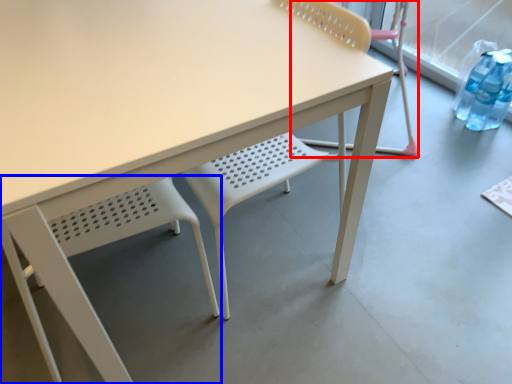
Question: Which object is further to the camera taking this photo, chair (highlighted by a red box) or chair (highlighted by a blue box)?

Choices:
 (A) chair
 (B) chair

Answer: (A)